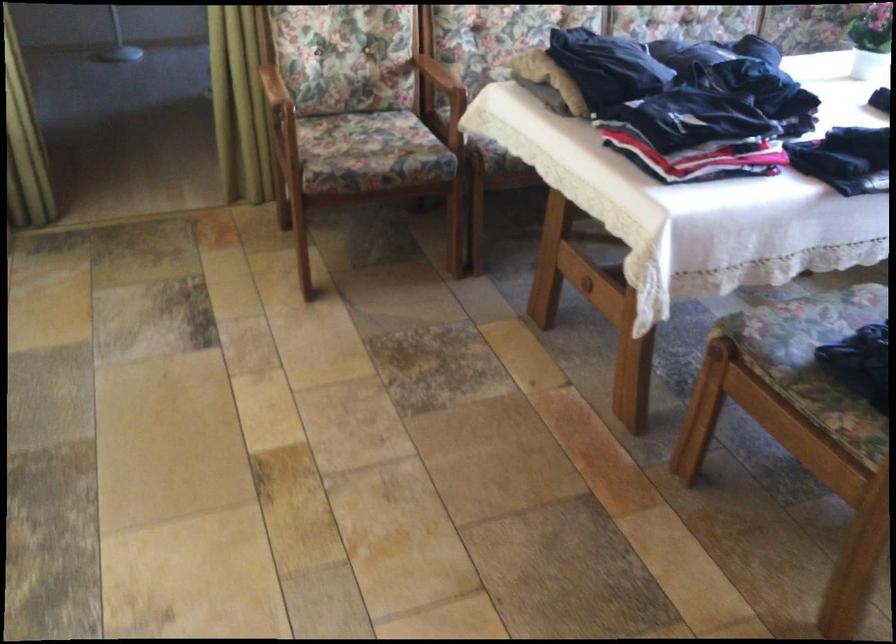
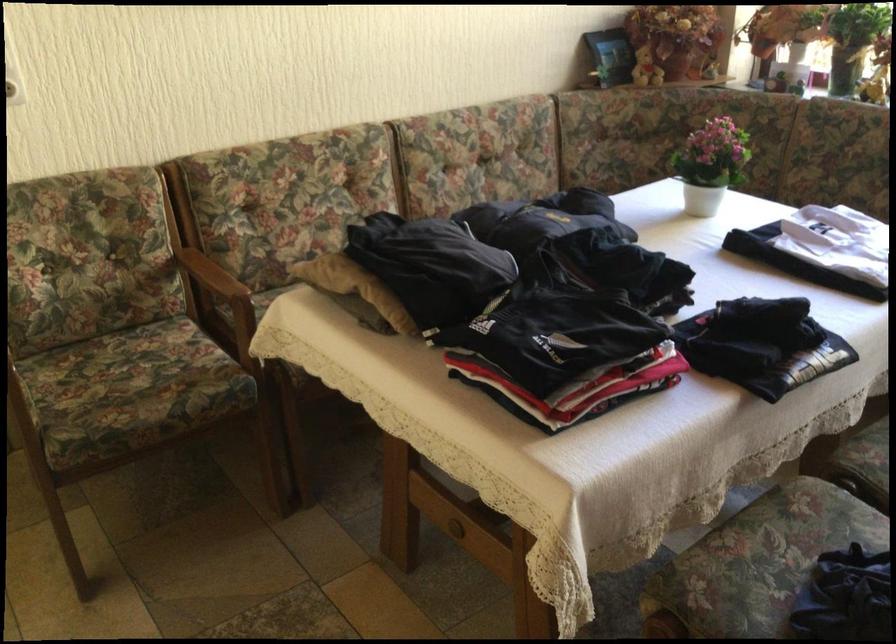
Where in the second image is the point corresponding to point 428,70 from the first image?

(204, 269)